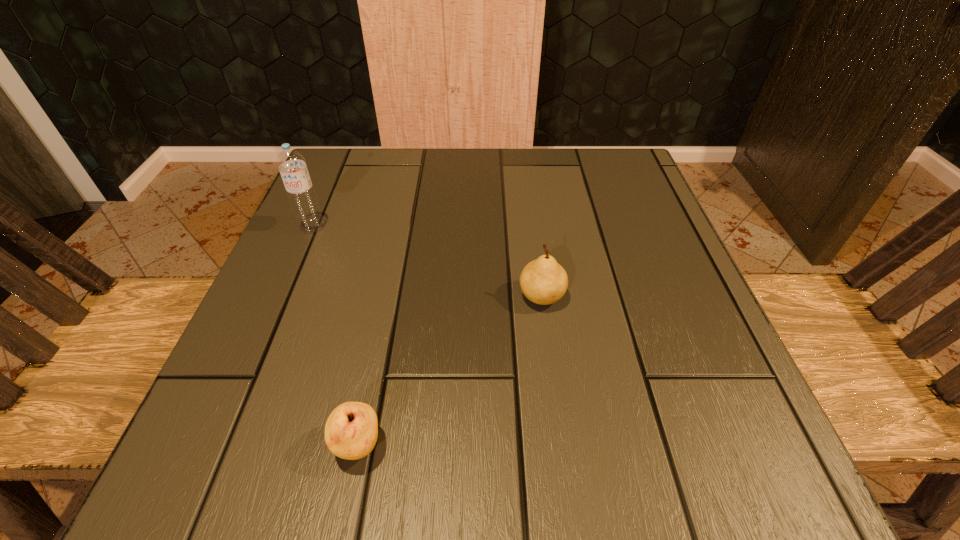
Identify which object is located as the second nearest to the tallest object. Please provide its 2D coordinates. Your answer should be formatted as a tuple, i.e. [(x, y)], where the tuple contains the x and y coordinates of a point satisfying the conditions above.

[(351, 431)]

You are a GUI agent. You are given a task and a screenshot of the screen. Output one action in this format:
    pyautogui.click(x=<x>, y=<y>)
    Task: Click on the vacant point that satisfies the following two spatial constraints: 1. on the front side of the rightmost object; 2. on the left side of the leftmost object
    
    Given the screenshot: What is the action you would take?
    pyautogui.click(x=282, y=296)

The image size is (960, 540). I want to click on free spot that satisfies the following two spatial constraints: 1. on the front side of the leftmost object; 2. on the left side of the nearest object, so click(218, 446).

Locate an element on the screen. free space that satisfies the following two spatial constraints: 1. on the back side of the rightmost object; 2. on the left side of the second object from left to right is located at coordinates pyautogui.click(x=389, y=296).

Locate an element on the screen. This screenshot has width=960, height=540. vacant point that satisfies the following two spatial constraints: 1. on the back side of the nearer pear; 2. on the right side of the taller pear is located at coordinates (389, 296).